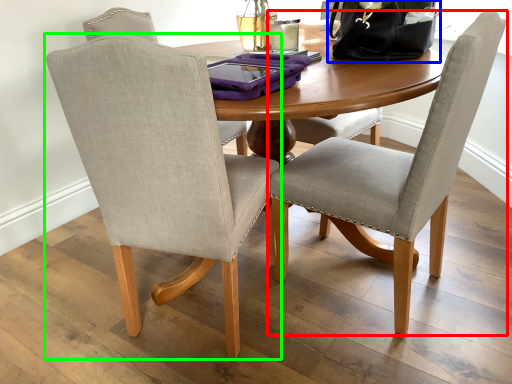
Question: Which object is the closest to the chair (highlighted by a red box)? Choose among these: handbag (highlighted by a blue box) or chair (highlighted by a green box).

Choices:
 (A) handbag
 (B) chair

Answer: (B)